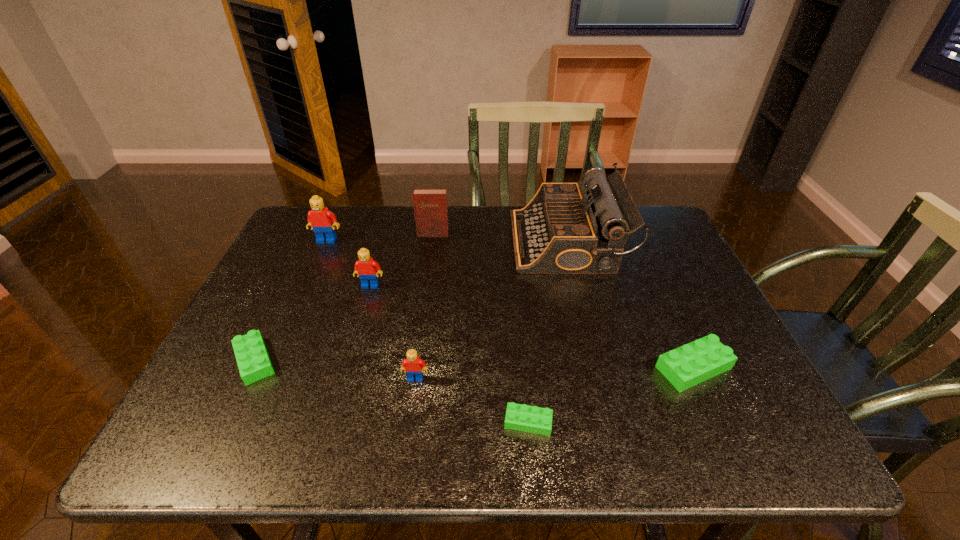
Where is `the second shortest Lego`? This screenshot has height=540, width=960. the second shortest Lego is located at coordinates (254, 364).

At what (x,y) coordinates should I click in order to perform the action: click on the leftmost green Lego. Please return your answer as a coordinate pair (x, y). Looking at the image, I should click on (254, 364).

Image resolution: width=960 pixels, height=540 pixels. Identify the location of the shortest Lego. (532, 419).

Where is `the nearest Lego`? The width and height of the screenshot is (960, 540). the nearest Lego is located at coordinates (532, 419).

Locate an element on the screen. This screenshot has height=540, width=960. vacant space located 0.120m on the keyboard of the tallest object is located at coordinates (472, 242).

Locate an element on the screen. The height and width of the screenshot is (540, 960). free region located 0.120m on the keyboard of the tallest object is located at coordinates (472, 242).

Where is `vacant space located 0.170m on the keyboard of the tallest object`? This screenshot has height=540, width=960. vacant space located 0.170m on the keyboard of the tallest object is located at coordinates (456, 242).

The width and height of the screenshot is (960, 540). What are the coordinates of `free region located 0.250m on the face of the tallest Lego` in the screenshot? It's located at (300, 302).

Where is `vacant space located 0.370m on the front cover of the diary`? The image size is (960, 540). vacant space located 0.370m on the front cover of the diary is located at coordinates (420, 327).

This screenshot has width=960, height=540. Identify the location of vacant area located 0.140m on the face of the second smallest red Lego. (358, 328).